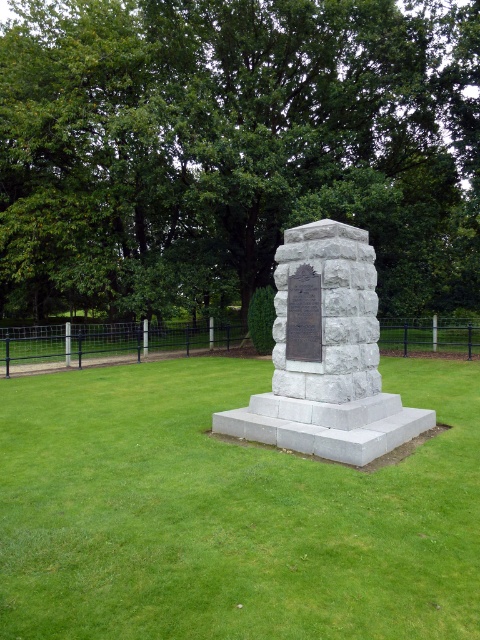
You are standing at the edge of the grassy area looking towards the monument. Which object, the green leafy tree at center or the green grass at center, is closer to you?

The green leafy tree at center is closer to you since the green grass at center is behind it.